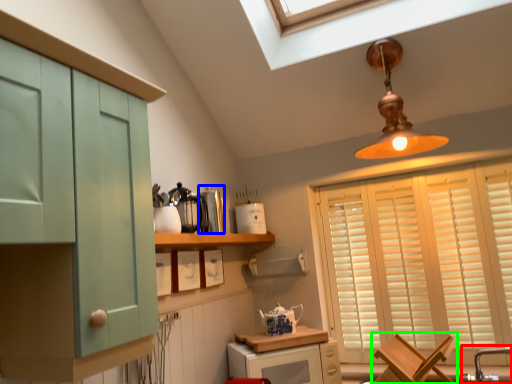
Question: Which object is the farthest from faucet (highlighted by a red box)? Choose among these: appliance (highlighted by a blue box) or chair (highlighted by a green box).

Choices:
 (A) appliance
 (B) chair

Answer: (A)